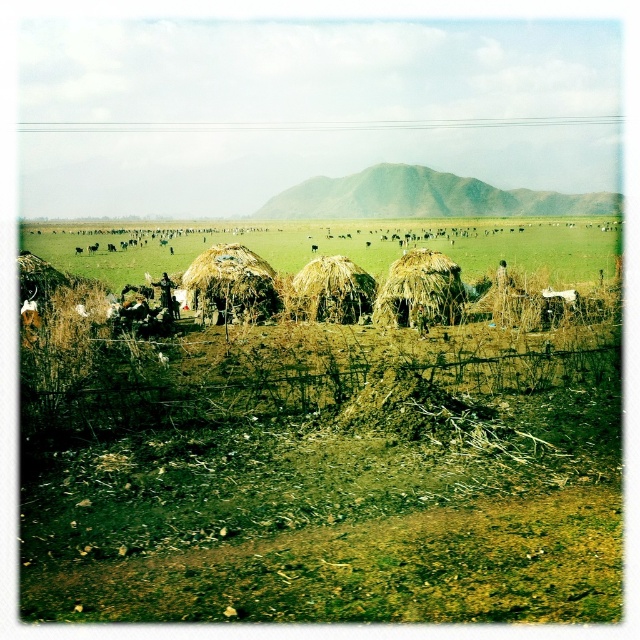
You are standing in front of the wire fence in the foreground of the rural landscape. You notice two huts labeled as brown straw huts at center and brown thatch hut at center. Which of these huts is located behind the other?

The brown straw huts at center is positioned over brown thatch hut at center, meaning the brown straw huts at center is behind the brown thatch hut at center.

You are standing in front of the wire fence in the foreground of the rural landscape. You want to walk to both the brown straw huts at center and the brown thatch hut at center. Which one should you reach first based on their distances from your current position?

The brown straw huts at center is 33.31 meters away from the brown thatch hut at center. Since you are standing at the wire fence in the foreground, the closer one would depend on their relative positions. However, the description only provides the distance between them, not their individual distances from you. Therefore, it is impossible to determine which one you will reach first without additional information about their positions relative to the fence.